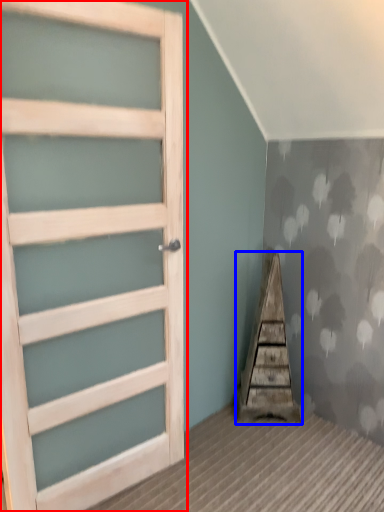
Question: Which object is closer to the camera taking this photo, door (highlighted by a red box) or stairwell (highlighted by a blue box)?

Choices:
 (A) door
 (B) stairwell

Answer: (A)